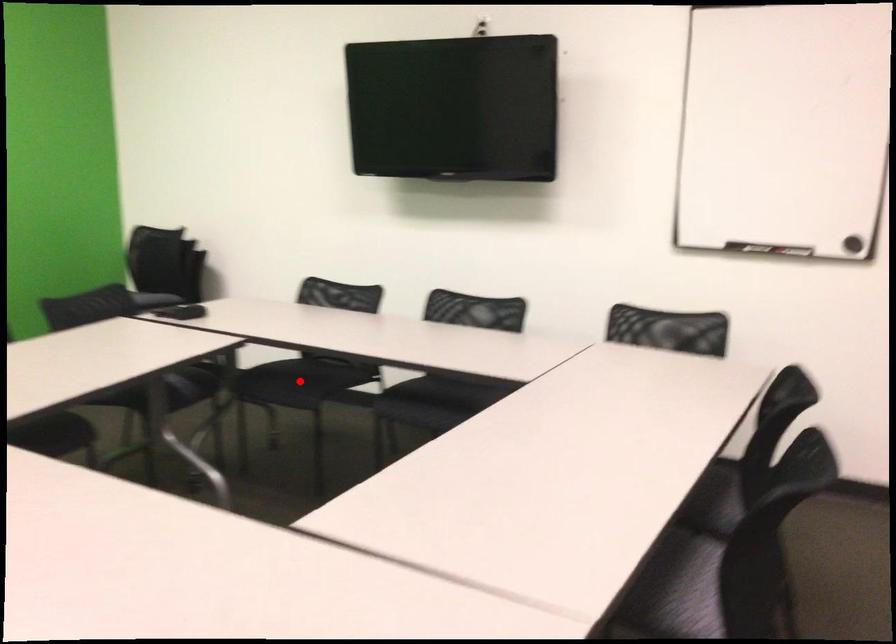
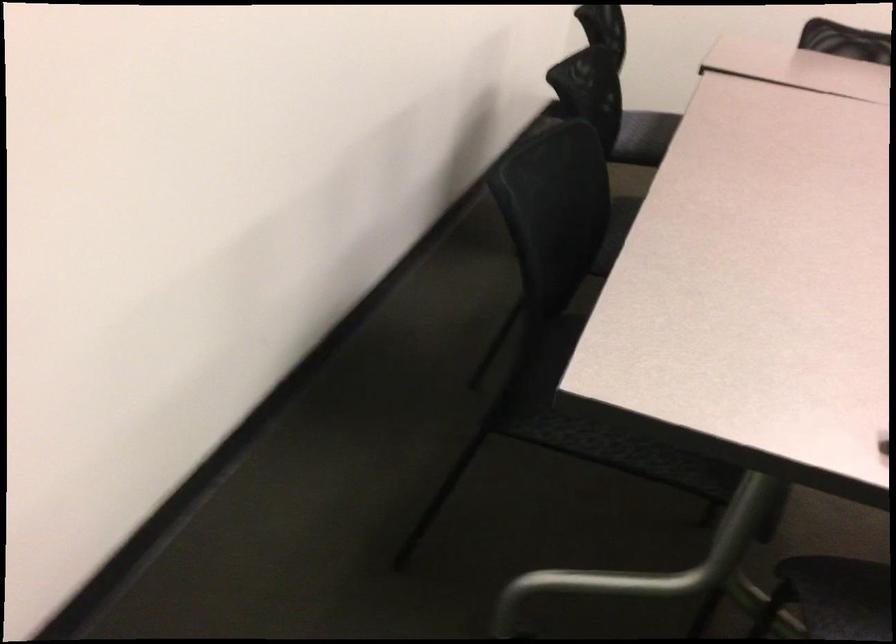
Question: I am providing you with two images of the same scene from different viewpoints. A red point is marked on the first image. Can you still see the location of the red point in image 2?

Choices:
 (A) Yes
 (B) No

Answer: (B)